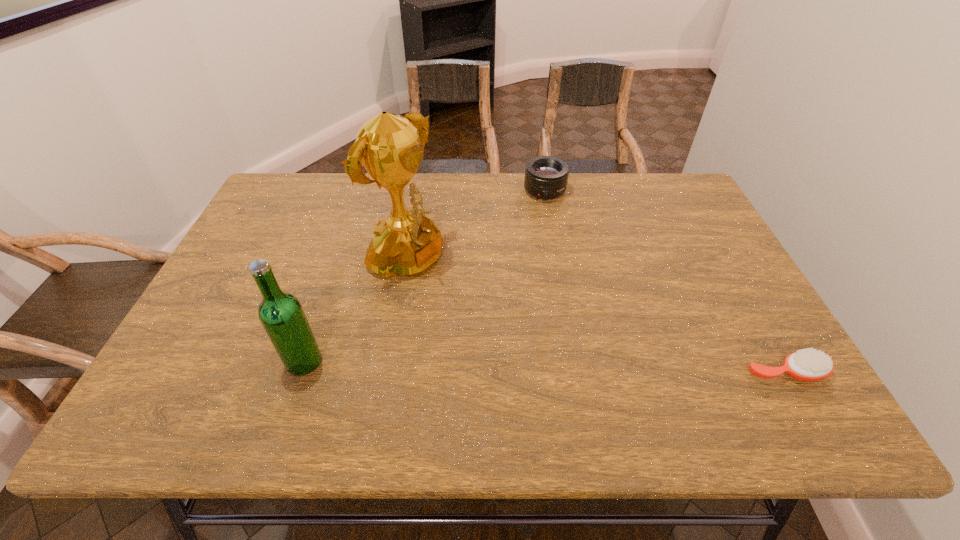
Find the location of a particular element. This screenshot has height=540, width=960. free space between the farthest object and the beer bottle is located at coordinates [424, 276].

Where is `unoccupied position between the shortest object and the third object from left to right`? Image resolution: width=960 pixels, height=540 pixels. unoccupied position between the shortest object and the third object from left to right is located at coordinates (664, 281).

Identify the location of unoccupied position between the second object from right to left and the leftmost object. This screenshot has height=540, width=960. (424, 276).

Where is `empty space between the shortest object and the beer bottle`? empty space between the shortest object and the beer bottle is located at coordinates (544, 367).

Locate an element on the screen. Image resolution: width=960 pixels, height=540 pixels. free space between the telephoto lens and the third object from right to left is located at coordinates (475, 226).

Find the location of `vacant region between the leftmost object and the telephoto lens`. vacant region between the leftmost object and the telephoto lens is located at coordinates pos(424,276).

Where is `free space between the tallest object and the hairbrush`? Image resolution: width=960 pixels, height=540 pixels. free space between the tallest object and the hairbrush is located at coordinates [595, 316].

This screenshot has height=540, width=960. In order to click on free spot between the third nearest object and the beer bottle in this screenshot , I will do 354,312.

This screenshot has height=540, width=960. Find the location of `object that stands as the second closest to the rightmost object`. object that stands as the second closest to the rightmost object is located at coordinates (389, 146).

Find the location of a particular element. The width and height of the screenshot is (960, 540). object identified as the third closest to the third object from right to left is located at coordinates (808, 364).